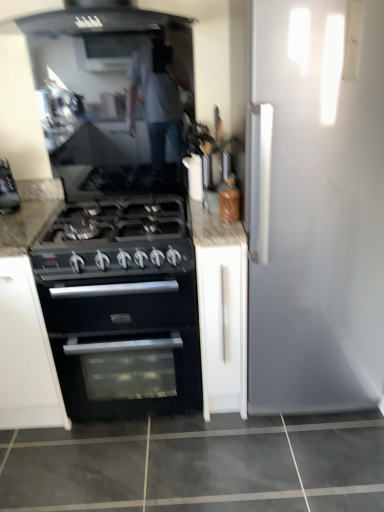
Question: Is black matte gas stove at center beside white matte cabinet at center?

Choices:
 (A) yes
 (B) no

Answer: (B)

Question: Is black matte gas stove at center to the right of white matte cabinet at center from the viewer's perspective?

Choices:
 (A) no
 (B) yes

Answer: (A)

Question: Is black matte gas stove at center in front of white matte cabinet at center?

Choices:
 (A) no
 (B) yes

Answer: (B)

Question: Does black matte gas stove at center appear on the left side of white matte cabinet at center?

Choices:
 (A) no
 (B) yes

Answer: (B)

Question: From the image's perspective, is black matte gas stove at center over white matte cabinet at center?

Choices:
 (A) no
 (B) yes

Answer: (B)

Question: Can we say black matte gas stove at center lies outside white matte cabinet at center?

Choices:
 (A) yes
 (B) no

Answer: (A)

Question: Is black matte oven at center located within white matte cabinet at center?

Choices:
 (A) yes
 (B) no

Answer: (B)

Question: Is white matte cabinet at center shorter than black matte oven at center?

Choices:
 (A) yes
 (B) no

Answer: (B)

Question: Is white matte cabinet at center smaller than black matte oven at center?

Choices:
 (A) yes
 (B) no

Answer: (A)

Question: From the image's perspective, is white matte cabinet at center on black matte oven at center?

Choices:
 (A) yes
 (B) no

Answer: (A)

Question: From the image's perspective, is white matte cabinet at center located beneath black matte oven at center?

Choices:
 (A) no
 (B) yes

Answer: (A)

Question: From a real-world perspective, is white matte cabinet at center on black matte oven at center?

Choices:
 (A) yes
 (B) no

Answer: (A)

Question: Does white matte cabinet at center have a greater height compared to black matte gas stove at center?

Choices:
 (A) yes
 (B) no

Answer: (A)